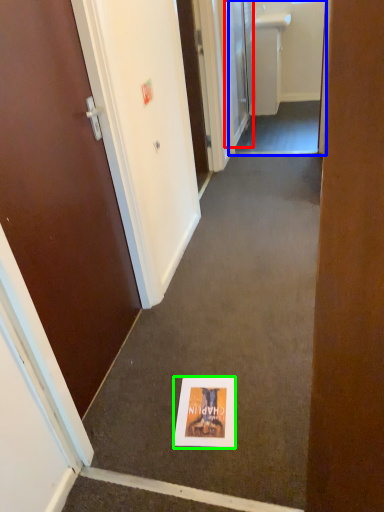
Question: Which object is the farthest from door (highlighted by a red box)? Choose among these: passage (highlighted by a blue box) or flyer (highlighted by a green box).

Choices:
 (A) passage
 (B) flyer

Answer: (B)